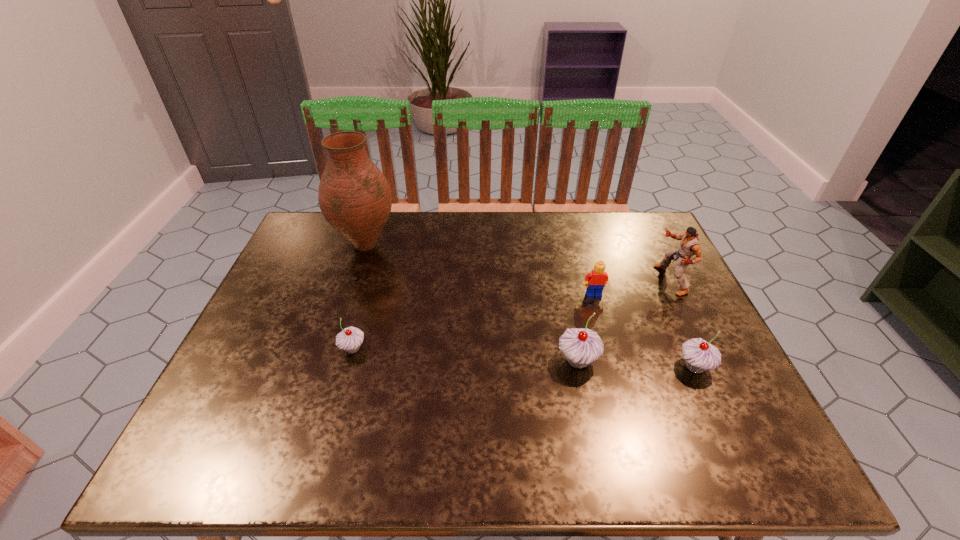
This screenshot has width=960, height=540. Find the location of `free space between the rightmost cupcake and the fifth shortest object`. free space between the rightmost cupcake and the fifth shortest object is located at coordinates (683, 323).

At what (x,y) coordinates should I click in order to perform the action: click on vacant space that's between the fifth shortest object and the tallest cupcake. Please return your answer as a coordinate pair (x, y). The height and width of the screenshot is (540, 960). Looking at the image, I should click on pos(624,320).

In order to click on vacant point located between the fifth shortest object and the Lego in this screenshot , I will do `click(632, 287)`.

Where is `vacant area that lies between the second tallest object and the third tallest object`? The width and height of the screenshot is (960, 540). vacant area that lies between the second tallest object and the third tallest object is located at coordinates (624, 320).

I want to click on empty space that is in between the puncher and the shortest cupcake, so click(x=512, y=314).

The image size is (960, 540). Find the location of `blank region between the vase and the Lego`. blank region between the vase and the Lego is located at coordinates (480, 269).

Image resolution: width=960 pixels, height=540 pixels. In order to click on object that is the third closest one to the Lego in this screenshot , I will do `click(699, 355)`.

Select which object is the fifth closest to the leftmost cupcake. Please provide its 2D coordinates. Your answer should be formatted as a tuple, i.e. [(x, y)], where the tuple contains the x and y coordinates of a point satisfying the conditions above.

[(689, 245)]

The height and width of the screenshot is (540, 960). In order to click on the second closest cupcake to the shortest cupcake in this screenshot , I will do `click(699, 355)`.

Identify which cupcake is the second nearest to the third tallest object. Please provide its 2D coordinates. Your answer should be formatted as a tuple, i.e. [(x, y)], where the tuple contains the x and y coordinates of a point satisfying the conditions above.

[(349, 339)]